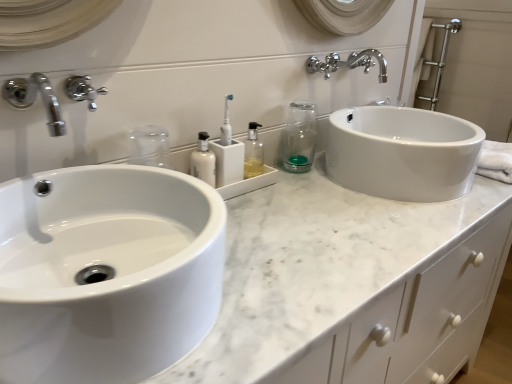
Find the location of a particular element. The width and height of the screenshot is (512, 384). vacant area that lies in front of transparent glass at center, the 2th mouthwash in the left-to-right sequence is located at coordinates (309, 190).